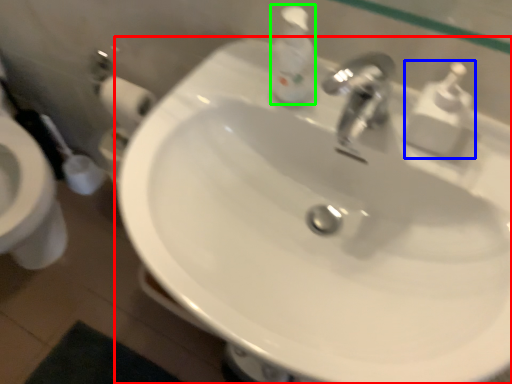
Question: Which is nearer to the sink (highlighted by a red box)? soap dispenser (highlighted by a blue box) or soap dispenser (highlighted by a green box).

Choices:
 (A) soap dispenser
 (B) soap dispenser

Answer: (B)